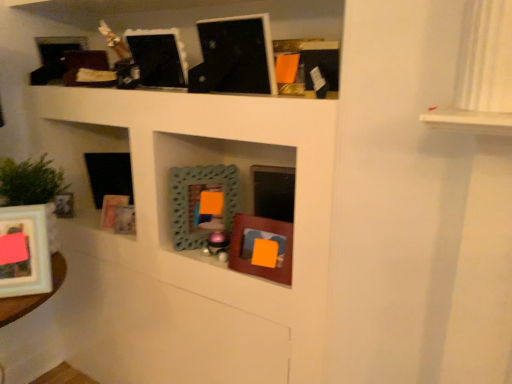
Question: Would you say matte white picture frame at lower left, arranged as the 2th picture frame when viewed from the left, is inside or outside matte black picture frame at left, acting as the 9th picture frame starting from the right?

Choices:
 (A) inside
 (B) outside

Answer: (B)

Question: From a real-world perspective, is matte white picture frame at lower left, which appears as the 8th picture frame when viewed from the right, above or below matte black picture frame at left, which is the 1th picture frame from left to right?

Choices:
 (A) above
 (B) below

Answer: (A)

Question: Which object is the farthest from the wooden picture frame at center, which is counted as the ninth picture frame, starting from the left?

Choices:
 (A) matte white picture frame at lower left, arranged as the 2th picture frame when viewed from the left
 (B) matte black picture frame at upper center, which is counted as the 2th picture frame, starting from the right
 (C) teal textured mirror at center, which is the 3th picture frame from right to left
 (D) matte black picture frame at left, acting as the 9th picture frame starting from the right
 (E) black matte picture frame at left, positioned as the third picture frame in left-to-right order

Answer: (D)

Question: Based on their relative distances, which object is farther from the matte white picture frame at lower left, which appears as the 8th picture frame when viewed from the right?

Choices:
 (A) matte black picture frame at left, which is the 1th picture frame from left to right
 (B) teal textured mirror at center, acting as the 7th picture frame starting from the left
 (C) matte black picture frame at upper center, which is counted as the 2th picture frame, starting from the right
 (D) matte black picture frame at upper center, the sixth picture frame in the left-to-right sequence
 (E) wooden picture frame at lower left, arranged as the 5th picture frame when viewed from the left

Answer: (C)